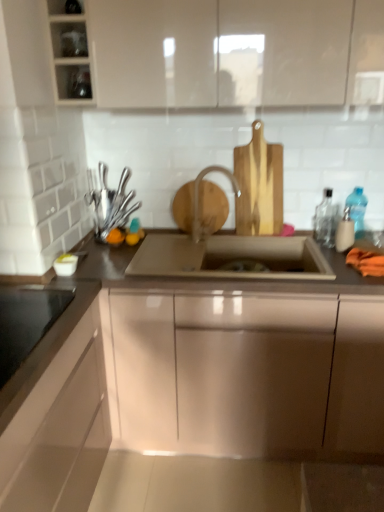
Find the location of a particular element. The image size is (384, 512). free space to the right of satin silver cutlery at left, which is the 1th appliance in right-to-left order is located at coordinates (158, 234).